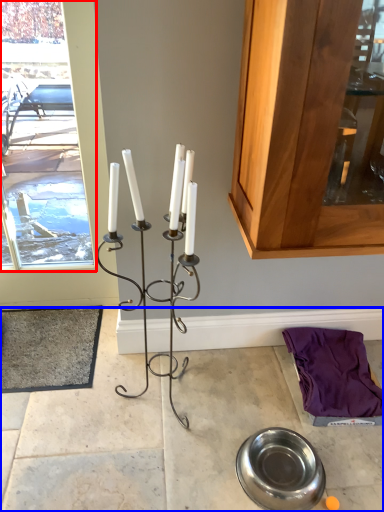
Question: Which object appears closest to the camera in this image, window frame (highlighted by a red box) or concrete (highlighted by a blue box)?

Choices:
 (A) window frame
 (B) concrete

Answer: (B)